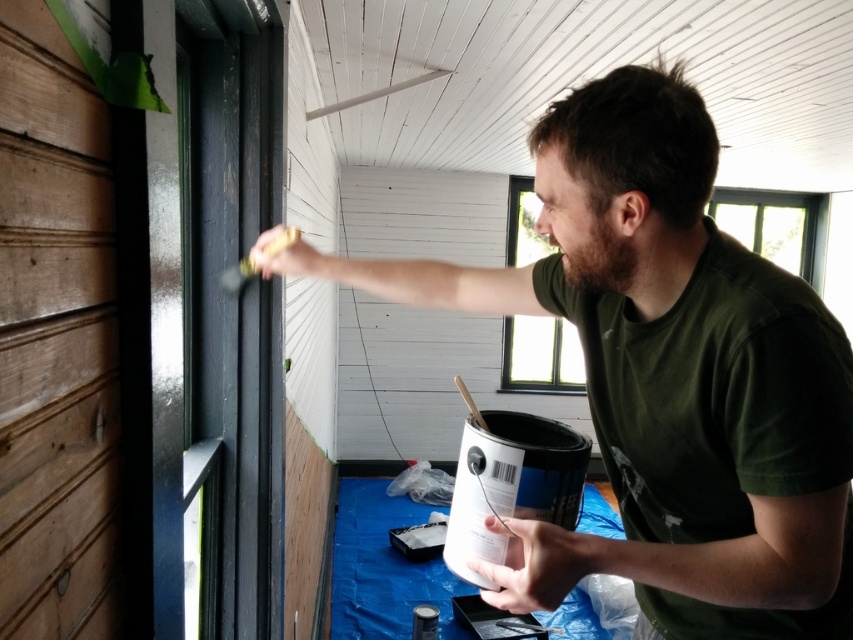
Who is more distant from viewer, (670,499) or (561,248)?

The point (670,499) is behind.

The image size is (853, 640). Find the location of `matte green t-shirt at center`. matte green t-shirt at center is located at coordinates (671, 378).

Describe the element at coordinates (671, 378) in the screenshot. The width and height of the screenshot is (853, 640). I see `matte green t-shirt at center` at that location.

The image size is (853, 640). What are the coordinates of `matte green t-shirt at center` in the screenshot? It's located at (671, 378).